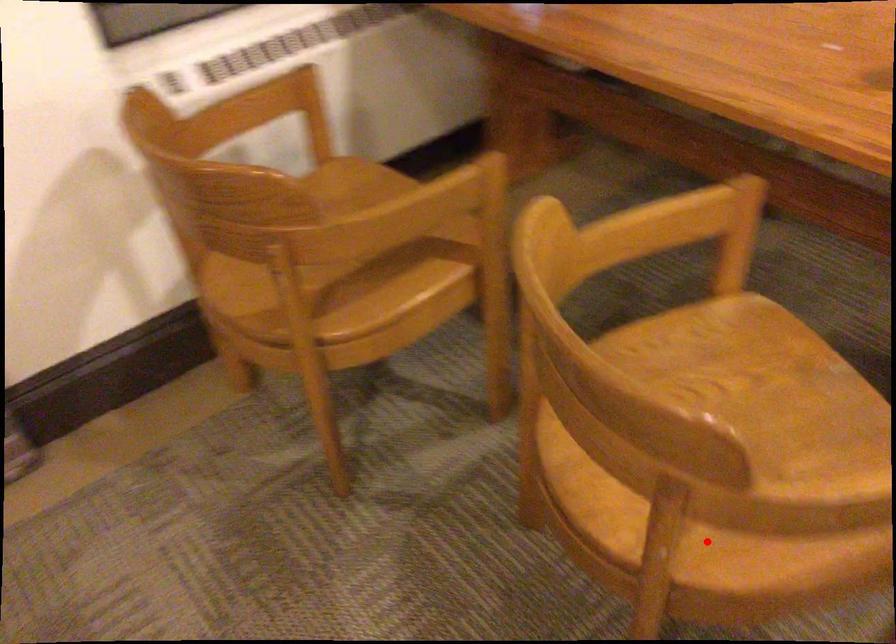
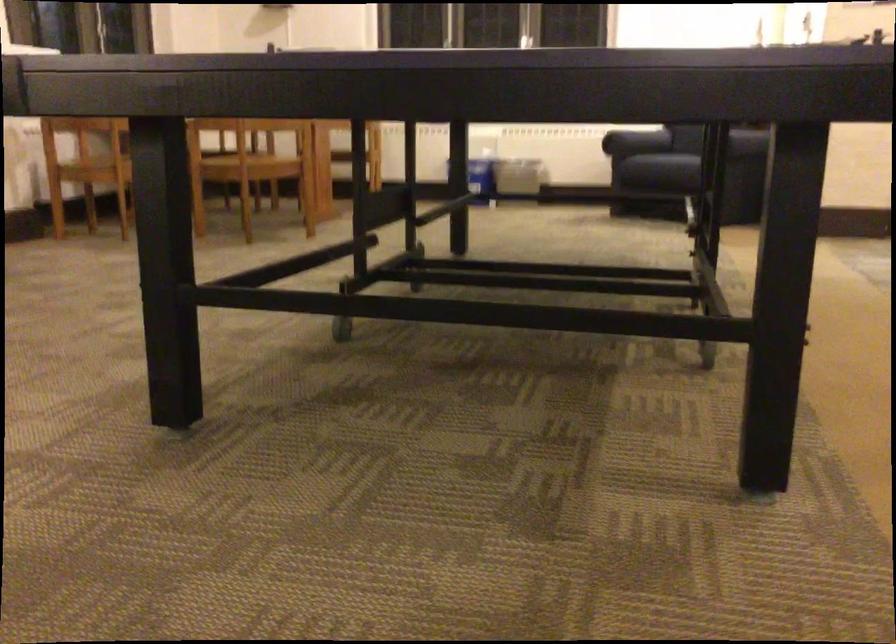
The point at the highlighted location is marked in the first image. Where is the corresponding point in the second image?

(248, 160)